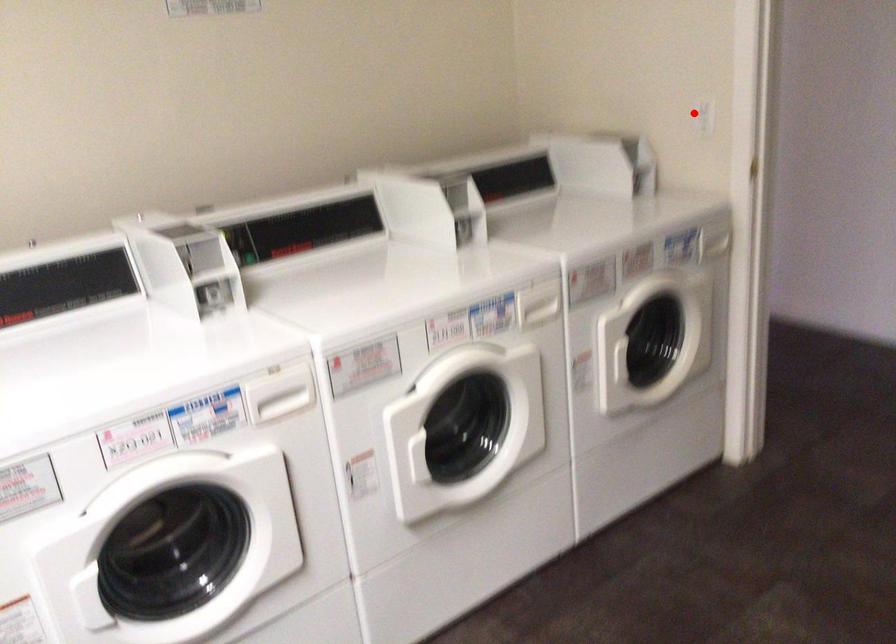
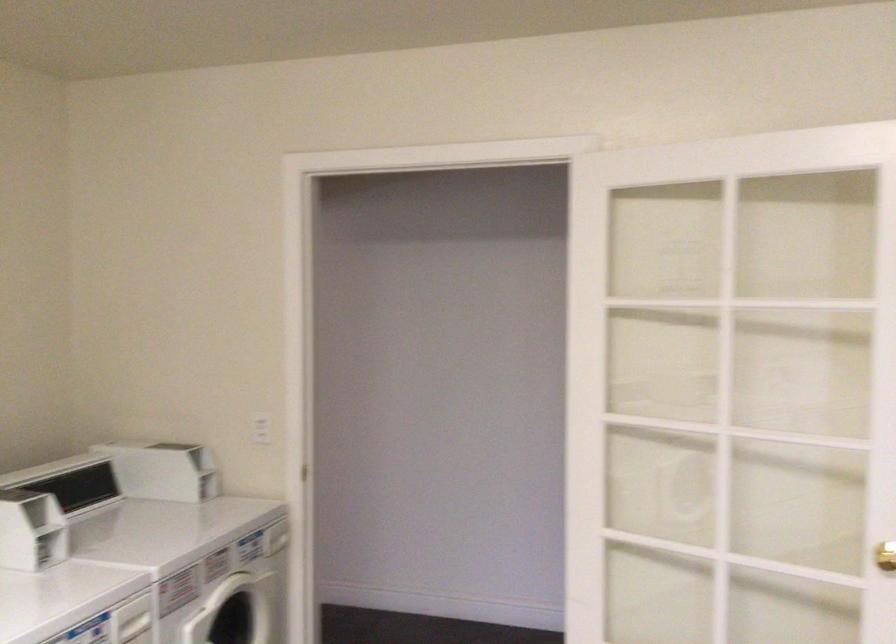
The point at the highlighted location is marked in the first image. Where is the corresponding point in the second image?

(261, 428)